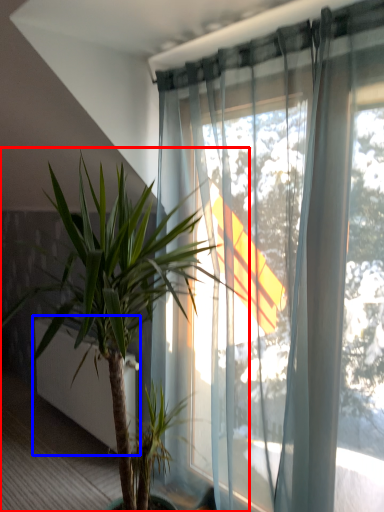
Question: Which point is further to the camera, houseplant (highlighted by a red box) or screen door (highlighted by a blue box)?

Choices:
 (A) houseplant
 (B) screen door

Answer: (B)